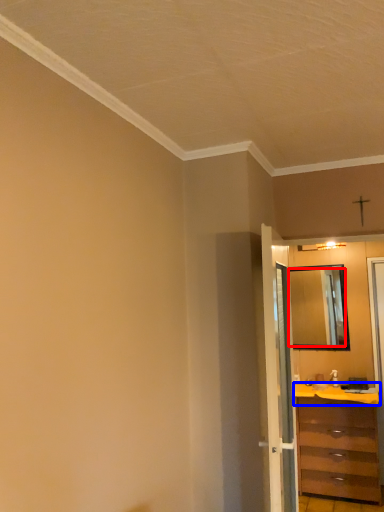
Question: Which point is further to the camera, mirror (highlighted by a red box) or counter top (highlighted by a blue box)?

Choices:
 (A) mirror
 (B) counter top

Answer: (A)